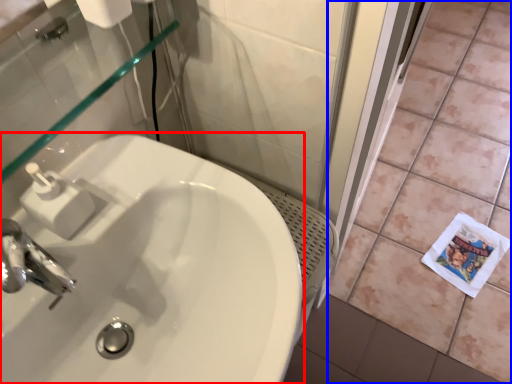
Question: Which point is further to the camera, sink (highlighted by a red box) or ceramic tile (highlighted by a blue box)?

Choices:
 (A) sink
 (B) ceramic tile

Answer: (B)